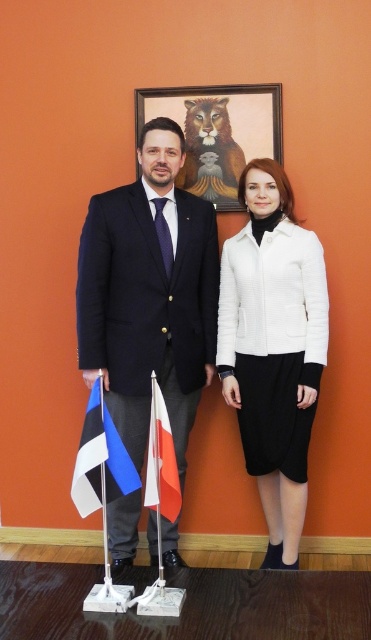
You are planning to take a photo of the scene. You want to ensure both the white fabric flag at center and the wooden frame at upper center are clearly visible in the shot. However, you notice that one is blocking the other. Which object is blocking the other?

The white fabric flag at center is behind the wooden frame at upper center, so the wooden frame at upper center is blocking the white fabric flag at center.

You are a photographer setting up for a group photo. You need to ensure that the wooden frame at upper center and the white fabric flag at center are both visible in the shot. Based on their positions, which object should appear higher in the final photograph?

The wooden frame at upper center should appear higher in the final photograph since it is positioned above the white fabric flag at center.

You are a photographer setting up for a group photo. The wooden frame at upper center and the white fabric flag at center are in your shot. You need to ensure that the distance between them is exactly 5 feet for proper composition. Based on the scene, will you need to adjust their positions?

The distance between the wooden frame at upper center and the white fabric flag at center is 5.03 feet, which is slightly more than 5 feet. Therefore, you should move them closer by 0.03 feet to achieve the desired distance.